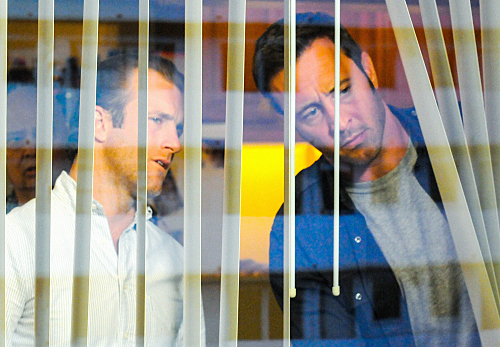
Identify the location of cabinet. (259, 17), (363, 18).